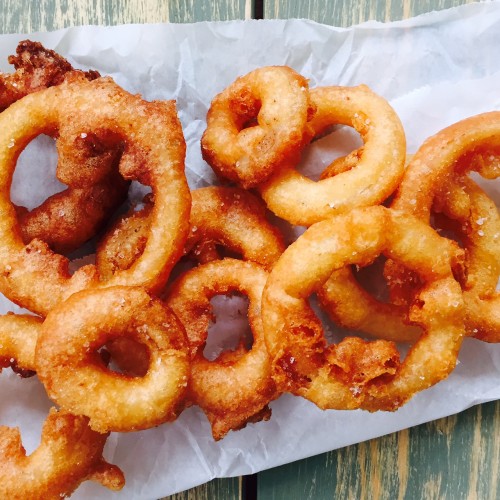
Locate an element on the screen. The width and height of the screenshot is (500, 500). wooden table is located at coordinates pyautogui.click(x=144, y=11).